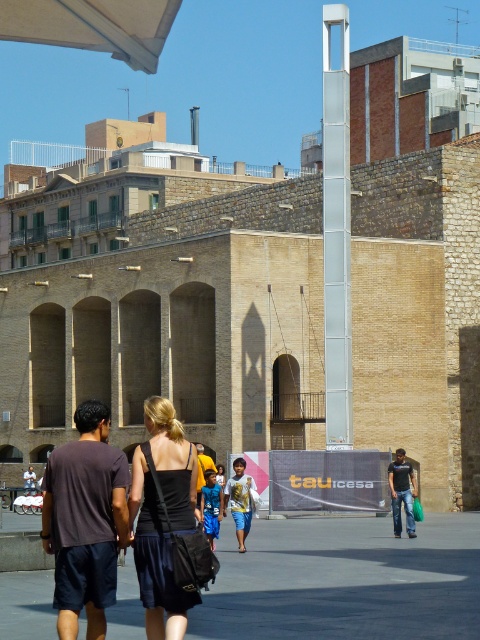
Question: Is dark brown t-shirt at center thinner than white fabric canopy at upper left?

Choices:
 (A) yes
 (B) no

Answer: (A)

Question: Which point is closer to the camera?

Choices:
 (A) white glass pillar at center
 (B) black fabric dress at center

Answer: (B)

Question: Which object is farther from the camera taking this photo?

Choices:
 (A) dark gray t-shirt at center
 (B) blue denim shorts at center
 (C) gray concrete pavement at center

Answer: (A)

Question: Which point is closer to the camera?

Choices:
 (A) (98, 410)
 (B) (409, 509)
 (C) (162, 611)
 (D) (200, 445)

Answer: (C)

Question: Is black fabric dress at center to the right of dark gray t-shirt at center from the viewer's perspective?

Choices:
 (A) no
 (B) yes

Answer: (A)

Question: Is gray concrete pavement at center closer to camera compared to blue denim shorts at center?

Choices:
 (A) yes
 (B) no

Answer: (B)